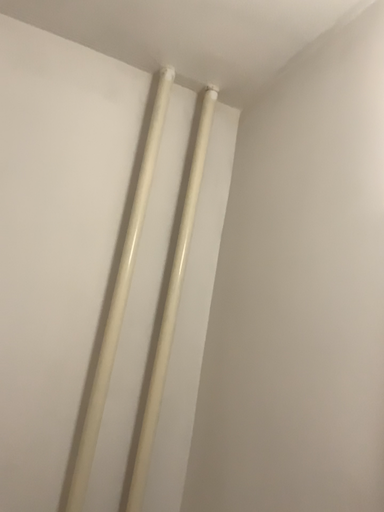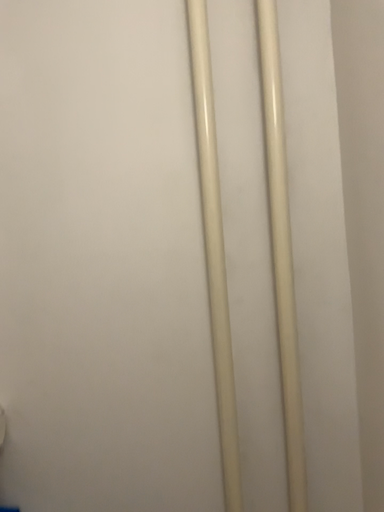
Question: Which way did the camera rotate in the video?

Choices:
 (A) rotated right
 (B) rotated left

Answer: (B)